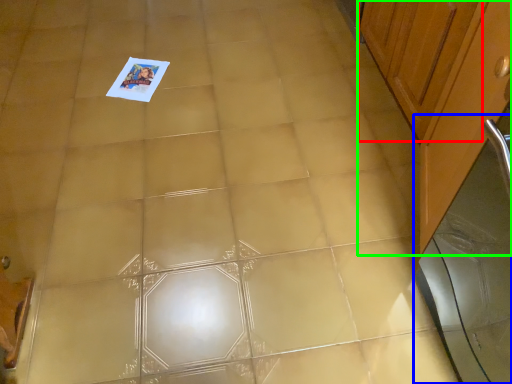
Question: Which object is positioned farthest from cabinetry (highlighted by a red box)? Select from screen door (highlighted by a blue box) and cabinetry (highlighted by a green box).

Choices:
 (A) screen door
 (B) cabinetry

Answer: (A)